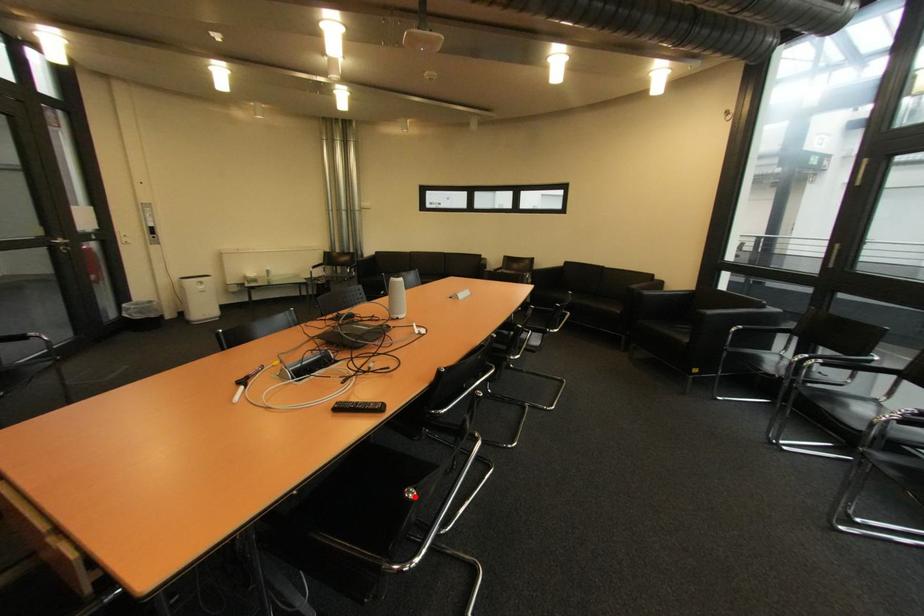
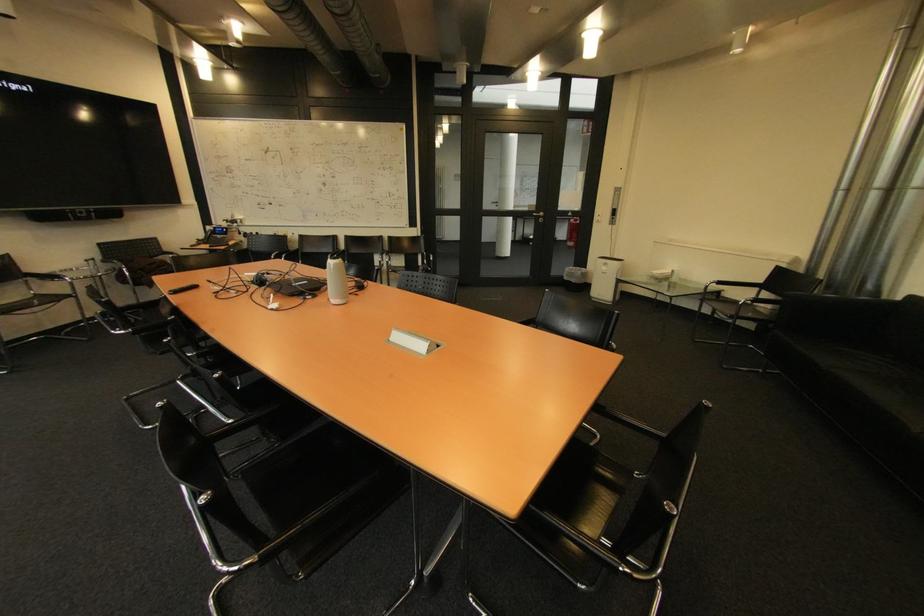
Question: I am providing you with two images of the same scene from different viewpoints. A red point is marked on the first image. At the location where the point appears in image 1, is it still visible in image 2?

Choices:
 (A) Yes
 (B) No

Answer: (B)